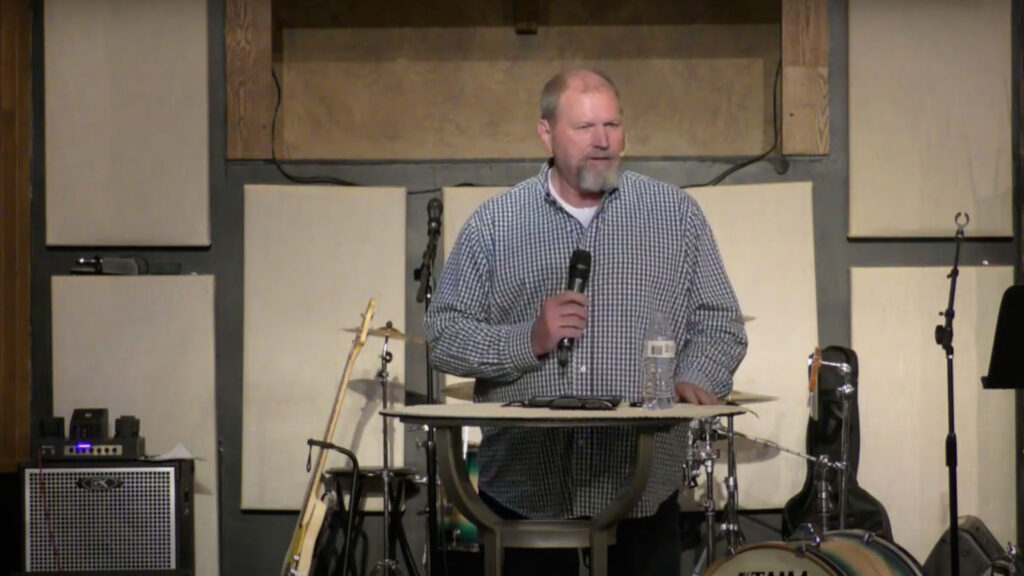
This screenshot has height=576, width=1024. In order to click on grey metal legs in this screenshot , I will do `click(492, 557)`, `click(602, 562)`.